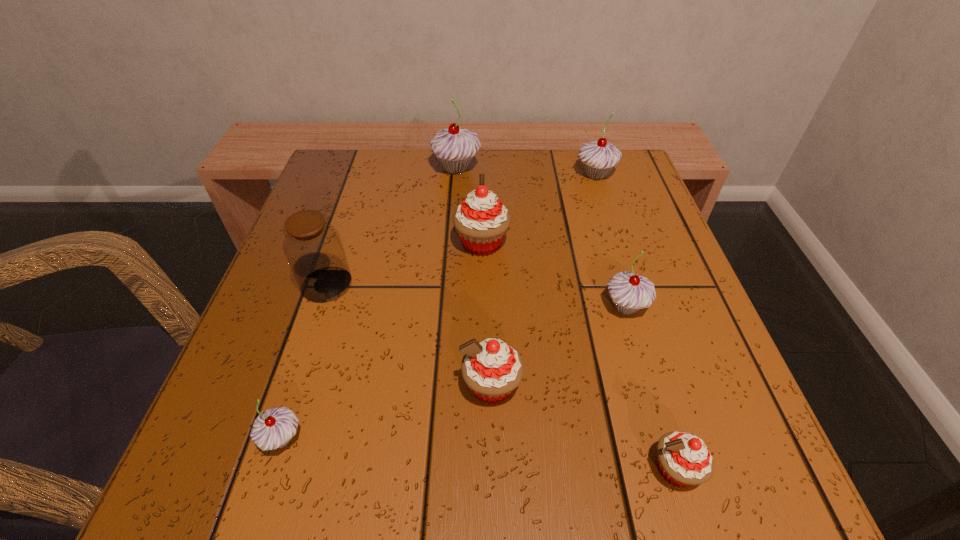
This screenshot has height=540, width=960. I want to click on free space that satisfies the following two spatial constraints: 1. on the back side of the third biggest gray cupcake; 2. on the left side of the fifth farthest cupcake, so click(490, 307).

What are the coordinates of `vacant position in the image that satisfies the following two spatial constraints: 1. on the front side of the leftmost cupcake; 2. on the right side of the smallest pink cupcake` in the screenshot? It's located at (272, 469).

This screenshot has width=960, height=540. I want to click on free space that satisfies the following two spatial constraints: 1. on the back side of the second nearest pink cupcake; 2. on the left side of the fourth farthest cupcake, so click(x=490, y=307).

Locate an element on the screen. The image size is (960, 540). vacant space that satisfies the following two spatial constraints: 1. on the front side of the third farthest cupcake; 2. on the left side of the tallest object is located at coordinates (450, 244).